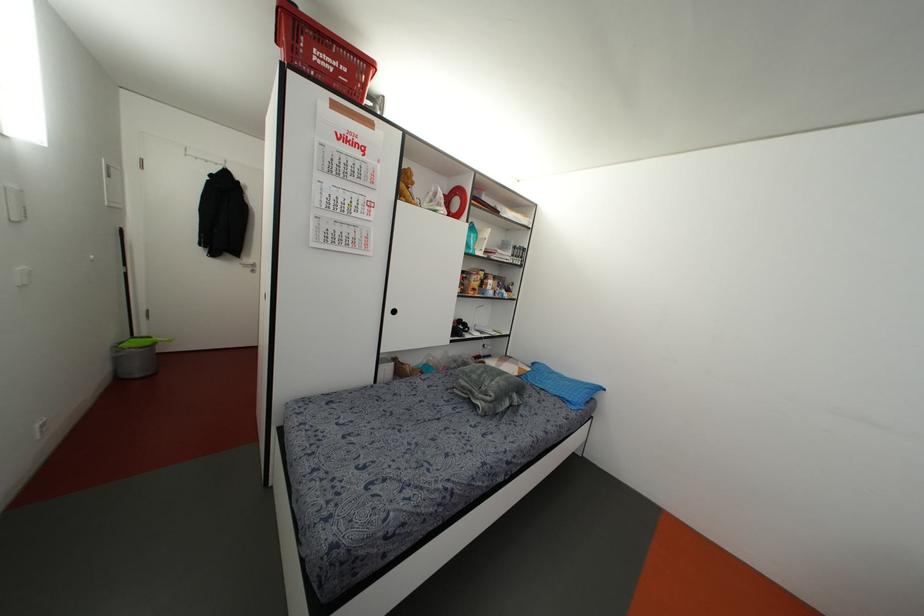
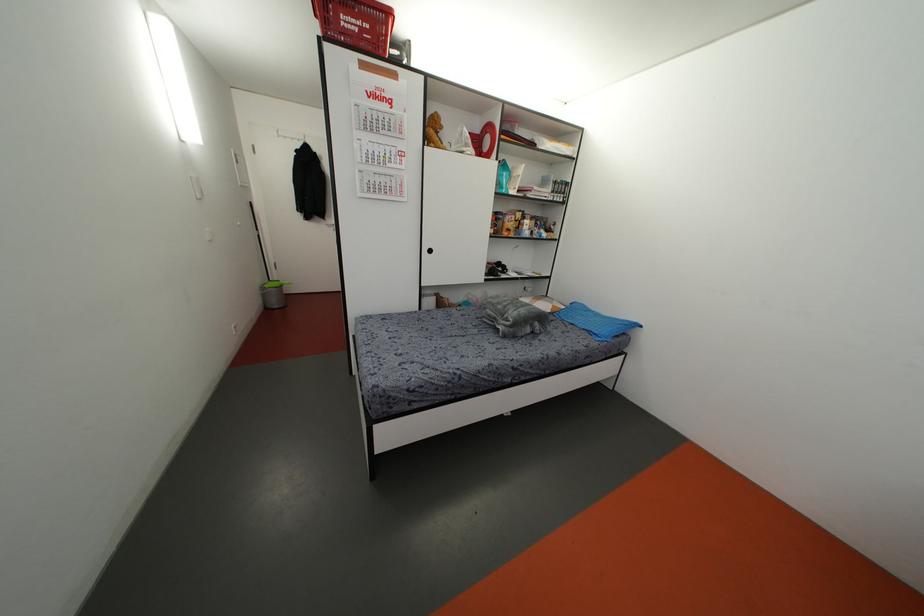
In the second image, find the point that corresponds to (473,289) in the first image.

(507, 229)